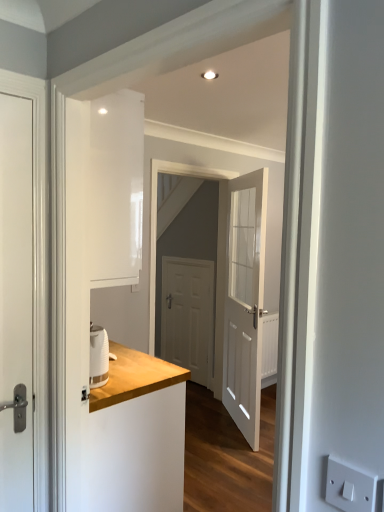
Question: Are white matte door at left, which ranks as the 1th door in front-to-back order, and white plastic electric outlet at lower right located far from each other?

Choices:
 (A) no
 (B) yes

Answer: (B)

Question: Are white matte door at left, which is the first door from left to right, and white plastic electric outlet at lower right beside each other?

Choices:
 (A) no
 (B) yes

Answer: (A)

Question: Considering the relative sizes of white matte door at left, the 3th door from the right, and white plastic electric outlet at lower right in the image provided, is white matte door at left, the 3th door from the right, thinner than white plastic electric outlet at lower right?

Choices:
 (A) no
 (B) yes

Answer: (A)

Question: Is white matte door at left, which ranks as the 3th door in back-to-front order, positioned with its back to white plastic electric outlet at lower right?

Choices:
 (A) yes
 (B) no

Answer: (B)

Question: Is white matte door at left, which is the first door from left to right, positioned beyond the bounds of white plastic electric outlet at lower right?

Choices:
 (A) no
 (B) yes

Answer: (B)

Question: From the image's perspective, relative to white wooden door at center, positioned as the second door in front-to-back order, is white matte door at center, positioned as the 3th door in front-to-back order, above or below?

Choices:
 (A) below
 (B) above

Answer: (A)

Question: Do you think white matte door at center, positioned as the second door in right-to-left order, is within white wooden door at center, which is the 3th door in left-to-right order, or outside of it?

Choices:
 (A) outside
 (B) inside

Answer: (A)

Question: Is point (175, 258) closer or farther from the camera than point (243, 230)?

Choices:
 (A) farther
 (B) closer

Answer: (A)

Question: Looking at the image, does white matte door at center, positioned as the second door in right-to-left order, seem bigger or smaller compared to white wooden door at center, positioned as the second door in front-to-back order?

Choices:
 (A) small
 (B) big

Answer: (A)

Question: Is point (354, 498) closer or farther from the camera than point (190, 347)?

Choices:
 (A) farther
 (B) closer

Answer: (B)

Question: From the image's perspective, relative to white matte door at center, positioned as the 3th door in front-to-back order, is white plastic electric outlet at lower right above or below?

Choices:
 (A) above
 (B) below

Answer: (A)

Question: Is white plastic electric outlet at lower right bigger or smaller than white matte door at center, positioned as the second door in right-to-left order?

Choices:
 (A) big
 (B) small

Answer: (B)

Question: Relative to white matte door at center, placed as the 1th door when sorted from back to front, is white plastic electric outlet at lower right in front or behind?

Choices:
 (A) front
 (B) behind

Answer: (A)

Question: From a real-world perspective, is white wooden door at center, which is the 3th door in left-to-right order, physically located above or below white matte door at center, positioned as the 3th door in front-to-back order?

Choices:
 (A) below
 (B) above

Answer: (B)

Question: Is white wooden door at center, which ranks as the 1th door in right-to-left order, bigger or smaller than white matte door at center, positioned as the second door in right-to-left order?

Choices:
 (A) big
 (B) small

Answer: (A)